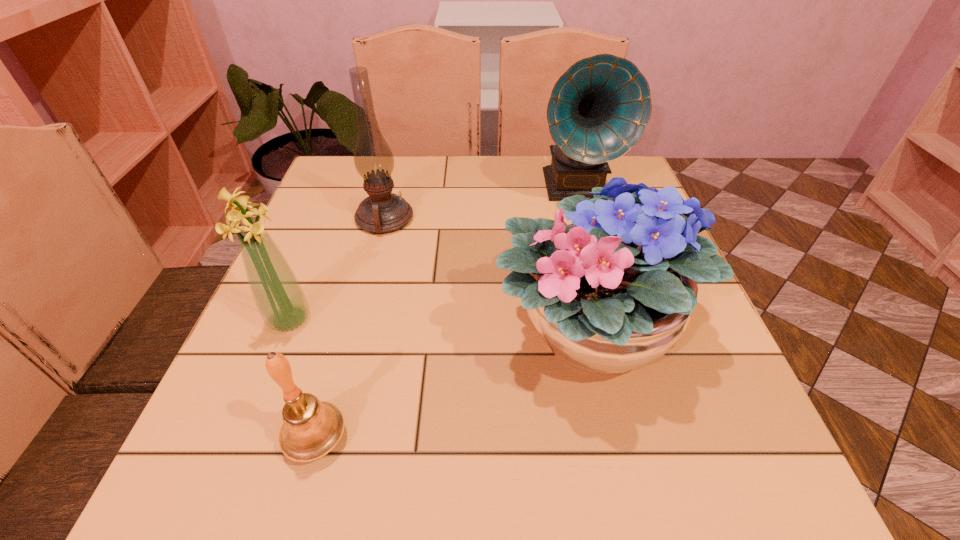
Find the location of a particular element. phonograph_record located in the far edge section of the desktop is located at coordinates (599, 108).

Locate an element on the screen. This screenshot has width=960, height=540. oil lamp present at the far edge is located at coordinates (382, 212).

This screenshot has width=960, height=540. Identify the location of object at the near edge. (311, 428).

Identify the location of oil lamp located at the left edge. This screenshot has width=960, height=540. (382, 212).

Find the location of a particular element. bouquet that is positioned at the left edge is located at coordinates (279, 297).

At what (x,y) coordinates should I click in order to perform the action: click on bell present at the left edge. Please return your answer as a coordinate pair (x, y). Image resolution: width=960 pixels, height=540 pixels. Looking at the image, I should click on (311, 428).

Find the location of a particular element. The image size is (960, 540). phonograph_record positioned at the right edge is located at coordinates (599, 108).

What are the coordinates of `bouquet positioned at the right edge` in the screenshot? It's located at (606, 296).

The width and height of the screenshot is (960, 540). Find the location of `object located in the far left corner section of the desktop`. object located in the far left corner section of the desktop is located at coordinates (382, 212).

The width and height of the screenshot is (960, 540). Find the location of `object that is at the near left corner`. object that is at the near left corner is located at coordinates (311, 428).